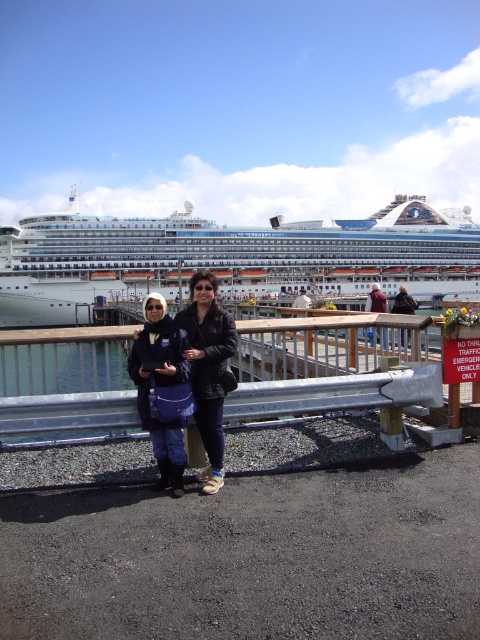
Question: Among these points, which one is nearest to the camera?

Choices:
 (A) (214, 352)
 (B) (146, 339)

Answer: (B)

Question: Does metal/rustic rail at center appear under blue denim jacket at center?

Choices:
 (A) yes
 (B) no

Answer: (A)

Question: Which object is the closest to the white glossy cruise ship at upper center?

Choices:
 (A) black leather jacket at center
 (B) blue denim jacket at center

Answer: (B)

Question: Considering the real-world distances, which object is closest to the blue denim jacket at center?

Choices:
 (A) black leather jacket at center
 (B) metal/rustic rail at center
 (C) white glossy cruise ship at upper center

Answer: (A)

Question: Does white glossy cruise ship at upper center appear over metal/rustic rail at center?

Choices:
 (A) yes
 (B) no

Answer: (A)

Question: Is white glossy cruise ship at upper center smaller than metal/rustic rail at center?

Choices:
 (A) no
 (B) yes

Answer: (A)